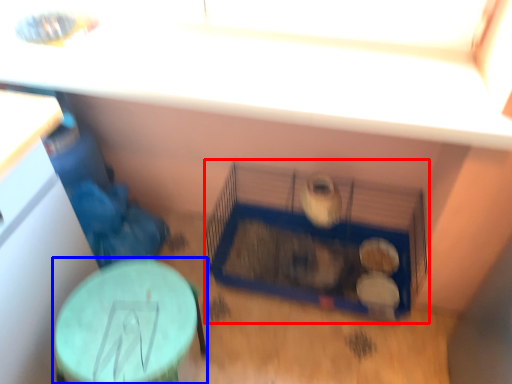
Question: Which object is closer to the camera taking this photo, bird cage (highlighted by a red box) or table (highlighted by a blue box)?

Choices:
 (A) bird cage
 (B) table

Answer: (B)